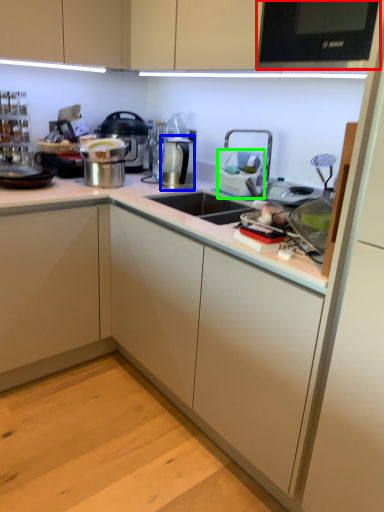
Question: Based on their relative distances, which object is nearer to home appliance (highlighted by a red box)? Choose from appliance (highlighted by a blue box) and appliance (highlighted by a green box).

Choices:
 (A) appliance
 (B) appliance

Answer: (B)